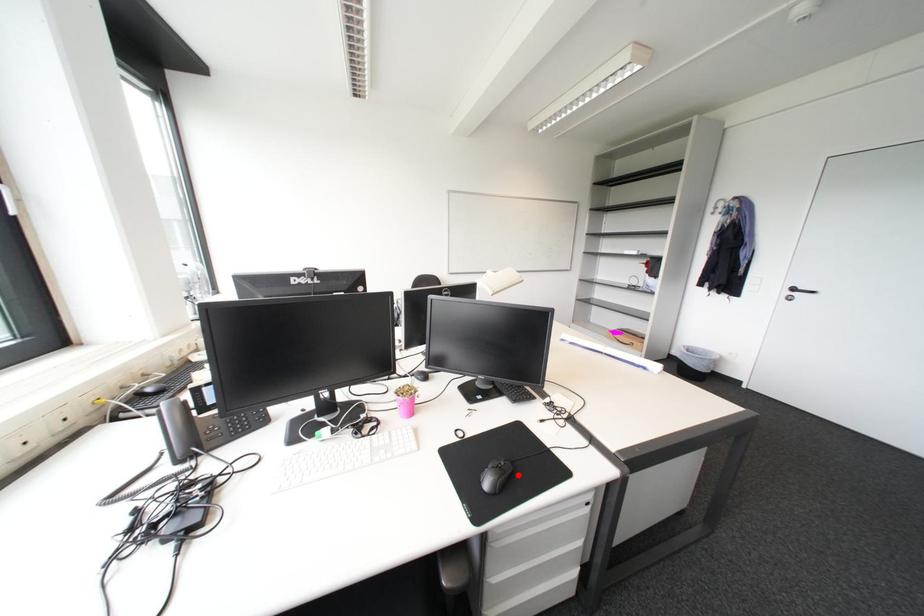
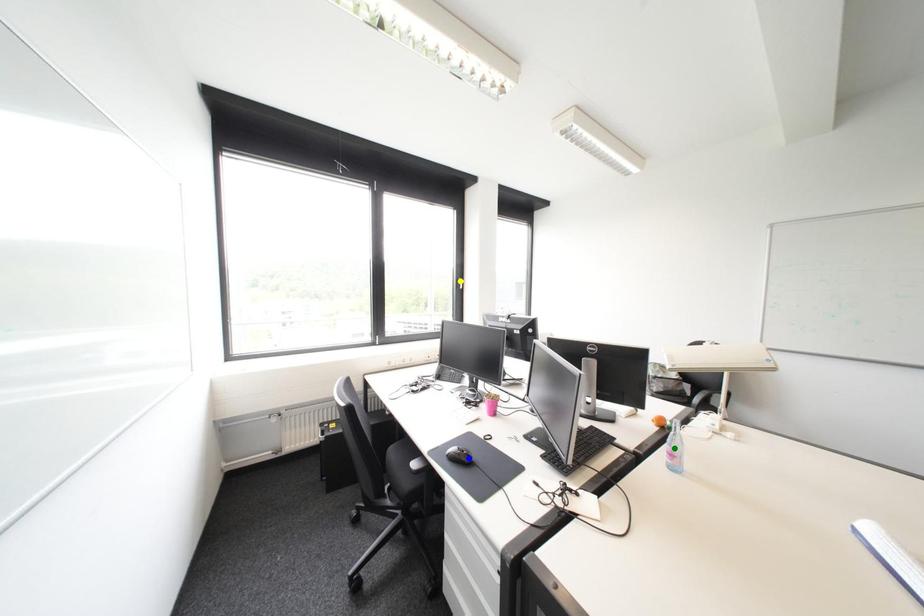
Question: I am providing you with two images of the same scene from different viewpoints. A red point is marked on the first image. You are given multiple points on the second image. Which point in image 2 is actually the same real-world point as the red point in image 1?

Choices:
 (A) green point
 (B) yellow point
 (C) blue point

Answer: (C)